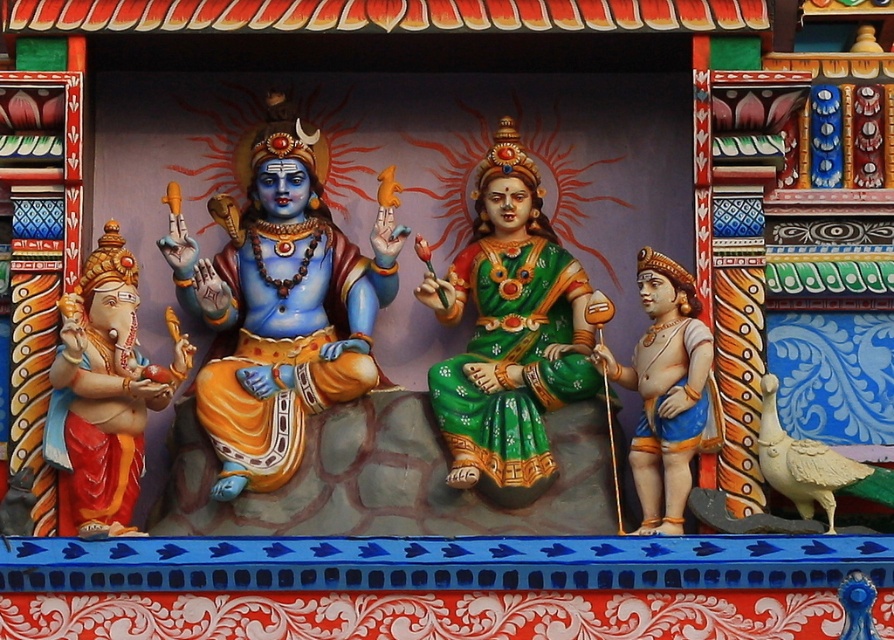
Question: Where is matte red cloth at left located in relation to matte gold statue at right in the image?

Choices:
 (A) left
 (B) right

Answer: (A)

Question: Among these objects, which one is farthest from the camera?

Choices:
 (A) green satin dress at center
 (B) matte red cloth at left
 (C) matte blue statue at center

Answer: (A)

Question: Can you confirm if matte blue statue at center is smaller than matte gold statue at right?

Choices:
 (A) yes
 (B) no

Answer: (B)

Question: Is matte blue statue at center wider than green satin dress at center?

Choices:
 (A) no
 (B) yes

Answer: (B)

Question: Which point appears closest to the camera in this image?

Choices:
 (A) (663, 428)
 (B) (257, 188)
 (C) (76, 429)
 (D) (456, 404)

Answer: (A)

Question: Which point is closer to the camera taking this photo?

Choices:
 (A) (358, 256)
 (B) (504, 400)
 (C) (56, 435)

Answer: (C)